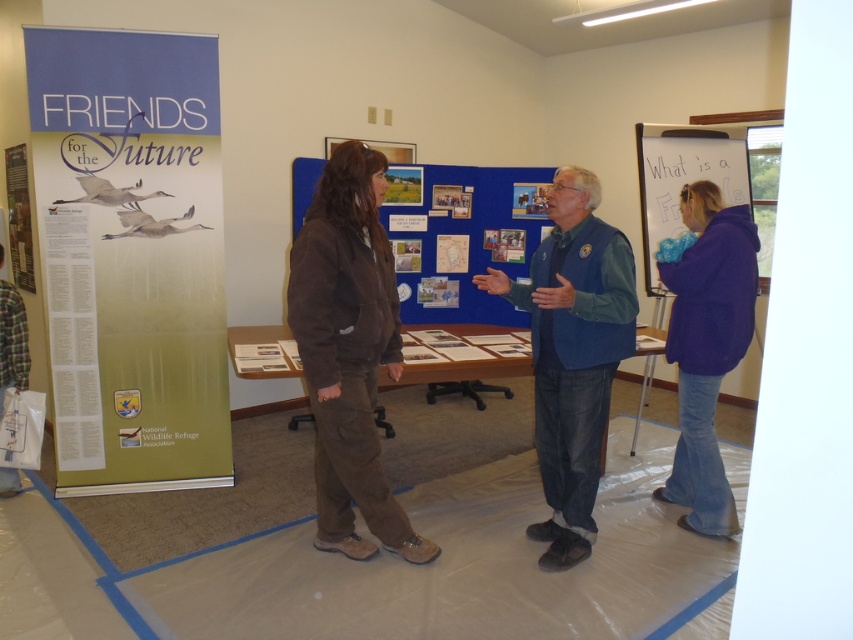
Is matte paper poster at left taller than purple fleece jacket at right?

Yes.

Is point (39, 44) less distant than point (723, 308)?

No.

Identify the location of matte paper poster at left. The height and width of the screenshot is (640, 853). (131, 256).

Is matte paper poster at left to the left of blue fabric poster at center from the viewer's perspective?

Indeed, matte paper poster at left is positioned on the left side of blue fabric poster at center.

How much distance is there between matte paper poster at left and blue fabric poster at center?

4.74 feet

Measure the distance between matte paper poster at left and camera.

They are 3.07 meters apart.

The height and width of the screenshot is (640, 853). Identify the location of matte paper poster at left. pos(131,256).

Which of these two, blue fabric poster at center or purple fleece jacket at right, stands taller?

Standing taller between the two is purple fleece jacket at right.

Does point (496, 209) come closer to viewer compared to point (730, 285)?

No.

Where is `blue fabric poster at center`? blue fabric poster at center is located at coordinates (461, 237).